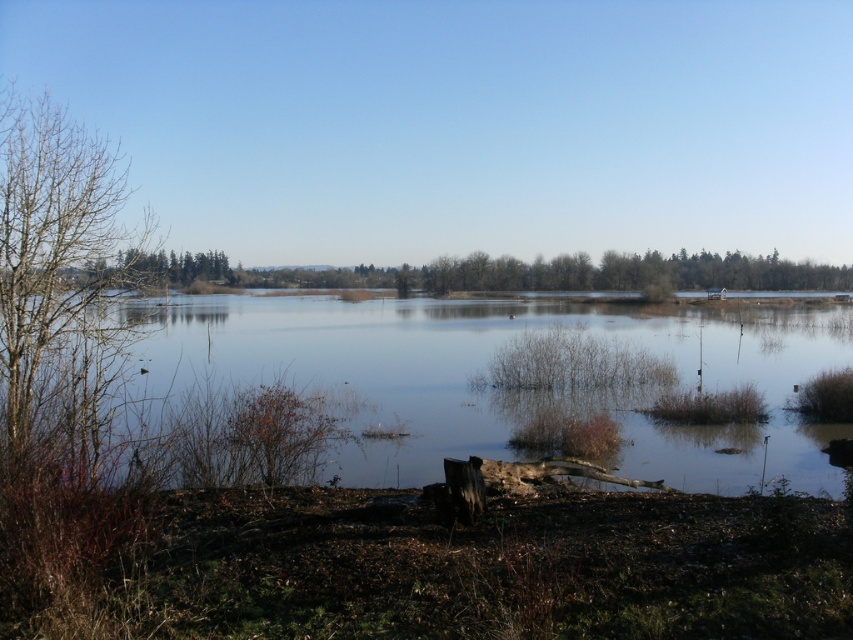
Between clear water at center and bare branches at left, which one appears on the left side from the viewer's perspective?

bare branches at left

Is point (601, 378) positioned after point (16, 248)?

Yes, point (601, 378) is farther from viewer.

Does point (527, 392) come closer to viewer compared to point (90, 296)?

That is False.

I want to click on clear water at center, so click(x=508, y=376).